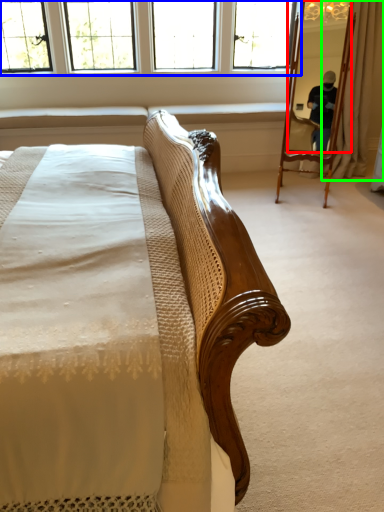
Question: Based on their relative distances, which object is nearer to mirror (highlighted by a red box)? Choose from window (highlighted by a blue box) and curtain (highlighted by a green box).

Choices:
 (A) window
 (B) curtain

Answer: (B)